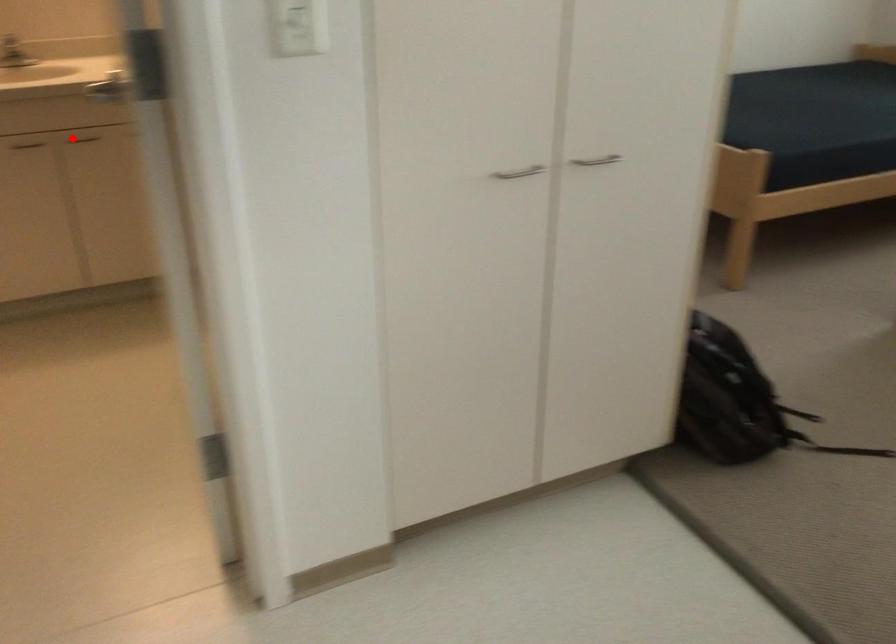
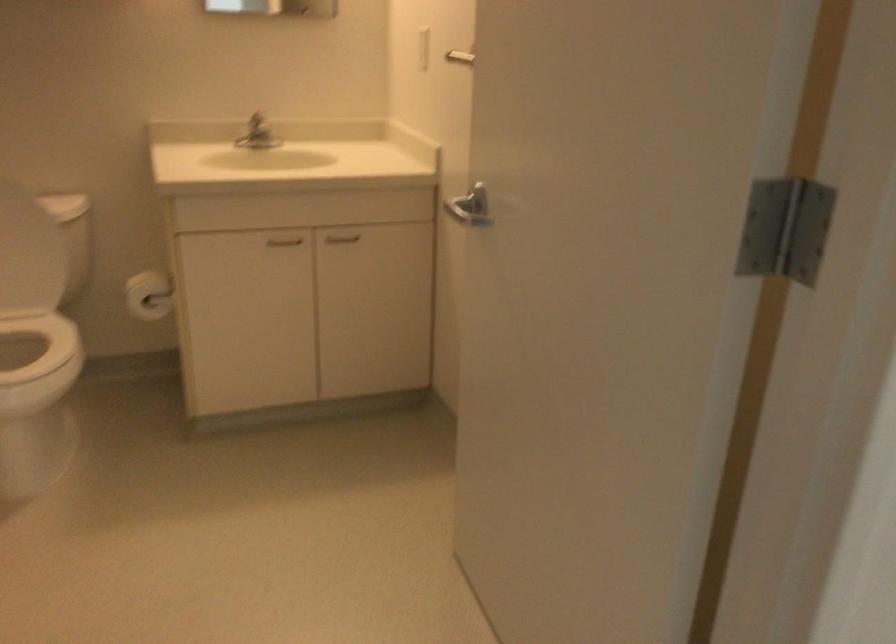
Locate, in the second image, the point that corresponds to the highlighted location in the first image.

(341, 238)